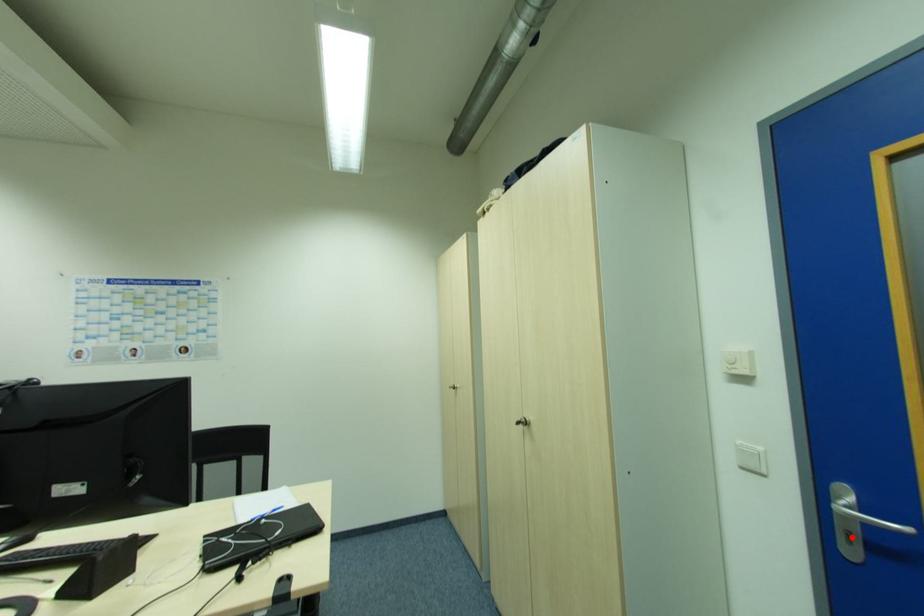
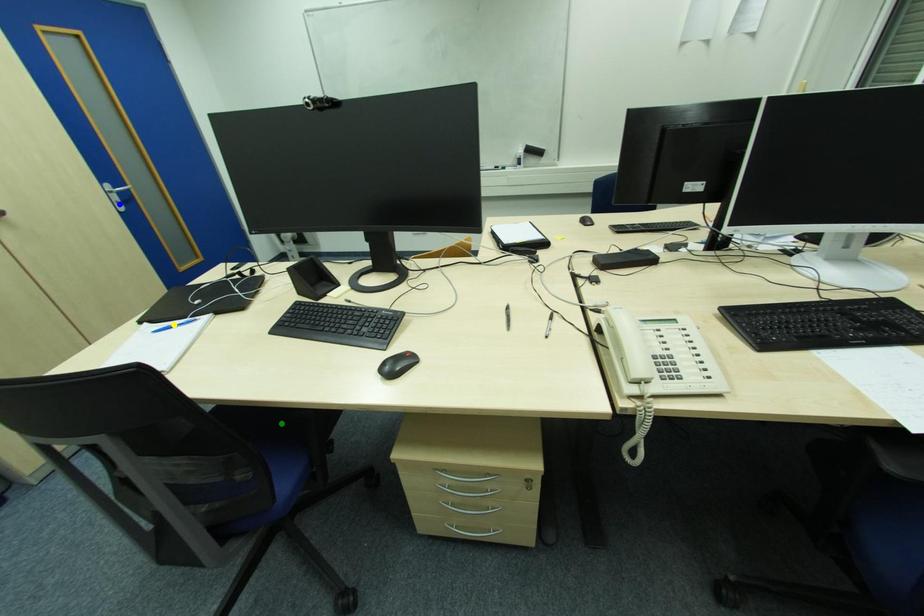
Question: I am providing you with two images of the same scene from different viewpoints. A red point is marked on the first image. You are given multiple points on the second image. Which spot in image 2 lines up with the point in image 1?

Choices:
 (A) blue point
 (B) yellow point
 (C) green point

Answer: (A)